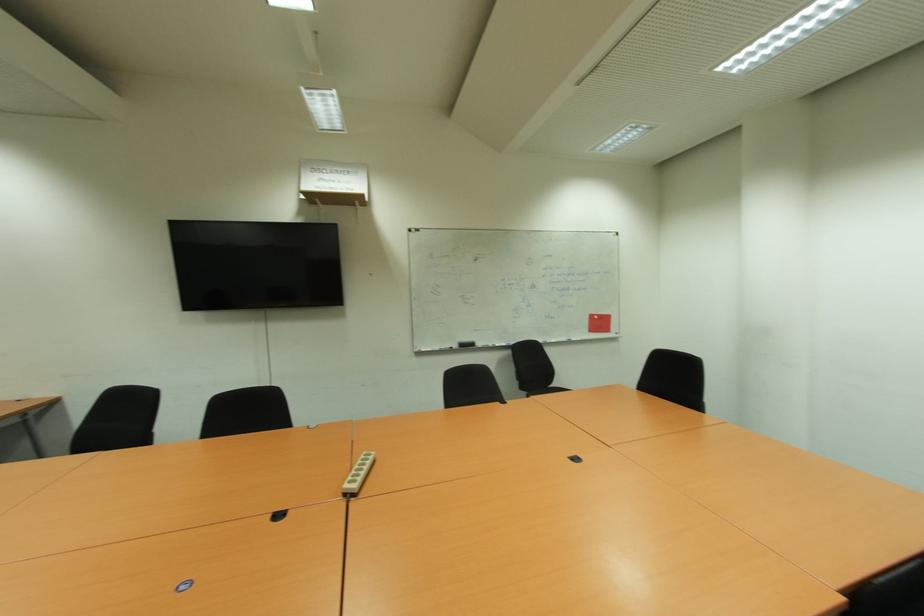
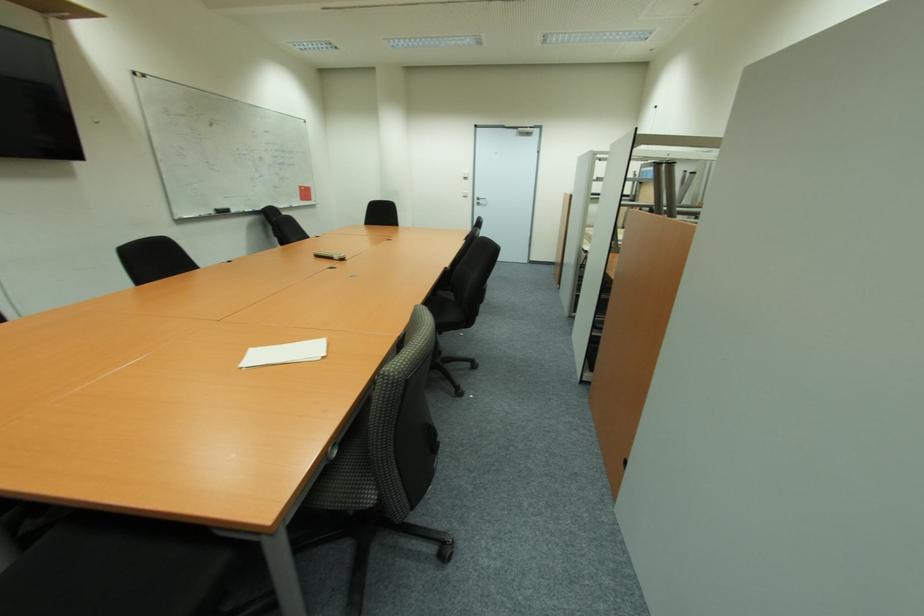
Where in the second image is the point corresponding to [457,347] from the first image?

(215, 214)